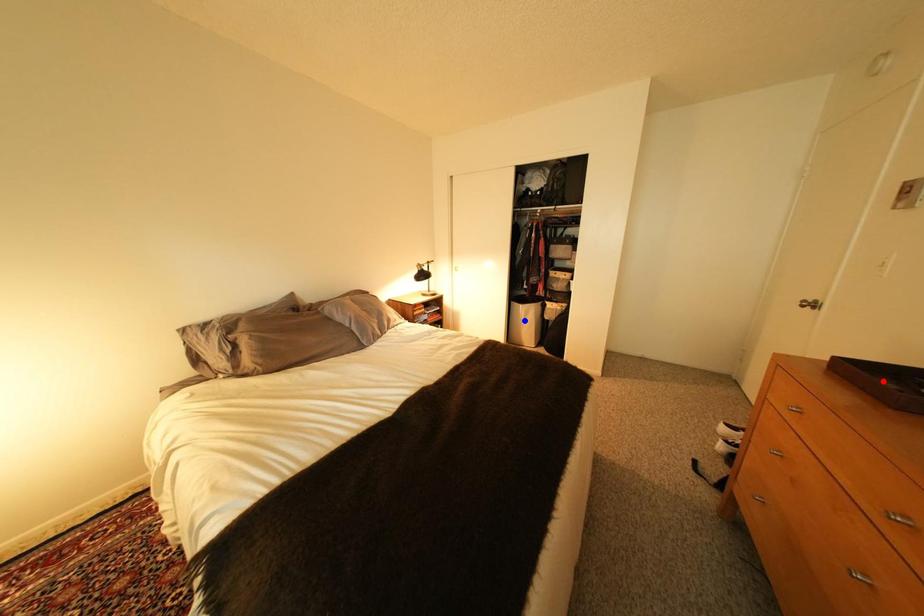
Question: Two points are marked on the image. Which point is closer to the camera?

Choices:
 (A) Blue point is closer.
 (B) Red point is closer.

Answer: (B)